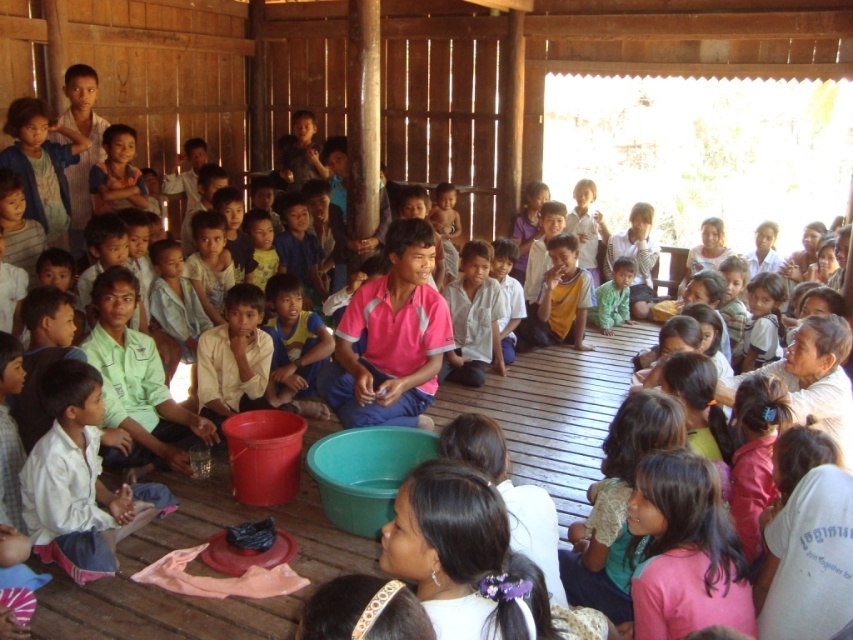
Does pink fabric shirt at center have a greater height compared to green matte shirt at center?

Yes.

Does point (404, 417) come closer to viewer compared to point (633, 276)?

Yes, it is in front of point (633, 276).

Is point (413, 353) closer to camera compared to point (606, 312)?

Yes, point (413, 353) is closer to viewer.

Identify the location of pink fabric shirt at center. (390, 337).

Does white matte shirt at upper right appear on the right side of white cotton shirt at center?

Indeed, white matte shirt at upper right is positioned on the right side of white cotton shirt at center.

This screenshot has height=640, width=853. Identify the location of white matte shirt at upper right. (811, 378).

What do you see at coordinates (811, 378) in the screenshot? I see `white matte shirt at upper right` at bounding box center [811, 378].

Can you confirm if white matte shirt at upper right is thinner than green matte shirt at center?

Incorrect, white matte shirt at upper right's width is not less than green matte shirt at center's.

At what (x,y) coordinates should I click in order to perform the action: click on white matte shirt at upper right. Please return your answer as a coordinate pair (x, y). This screenshot has height=640, width=853. Looking at the image, I should click on [x=811, y=378].

Find the location of a particular element. Image resolution: width=853 pixels, height=640 pixels. white matte shirt at upper right is located at coordinates pos(811,378).